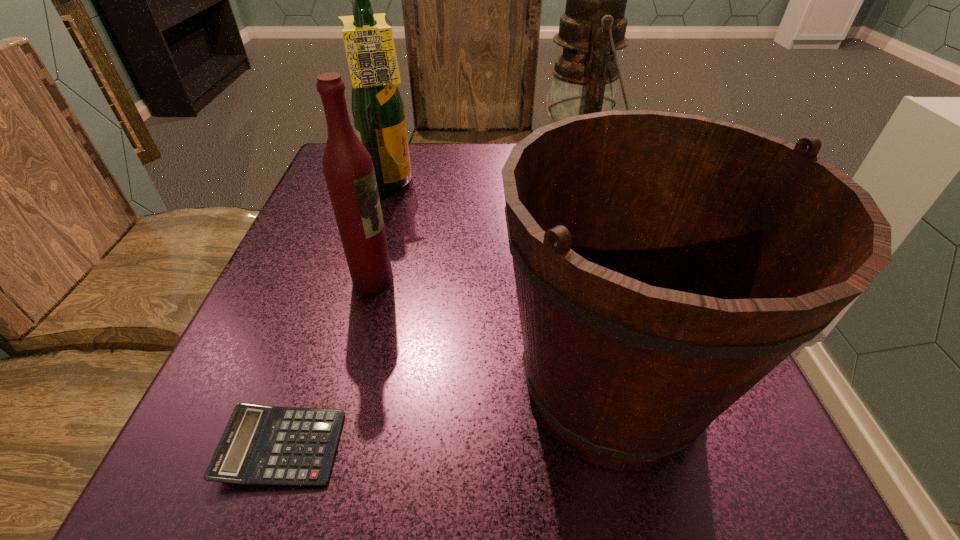
Where is `object at the far right corner`? object at the far right corner is located at coordinates 593,27.

Find the location of `object present at the near right corner`. object present at the near right corner is located at coordinates (665, 263).

This screenshot has width=960, height=540. In order to click on vacant space at the far edge of the desktop in this screenshot , I will do `click(432, 148)`.

Locate an element on the screen. Image resolution: width=960 pixels, height=540 pixels. free space at the left edge is located at coordinates (349, 293).

You are a GUI agent. You are given a task and a screenshot of the screen. Output one action in this format:
    pyautogui.click(x=<x>, y=<y>)
    Task: Click on the free point at the near left corner
    Image resolution: width=960 pixels, height=540 pixels.
    Given the screenshot: What is the action you would take?
    pyautogui.click(x=276, y=487)

Identify the location of vacant space at the near right corner of the desktop. (x=771, y=475).

In order to click on free space between the shortest object and the bucket in this screenshot , I will do `click(447, 413)`.

Where is `vacant space that is in between the nearer liquor and the calculator`? This screenshot has width=960, height=540. vacant space that is in between the nearer liquor and the calculator is located at coordinates (328, 363).

The width and height of the screenshot is (960, 540). In order to click on vacant region between the third farthest object and the lantern in this screenshot , I will do `click(474, 227)`.

Find the location of `free space between the calculator and the nearer liquor`. free space between the calculator and the nearer liquor is located at coordinates (328, 363).